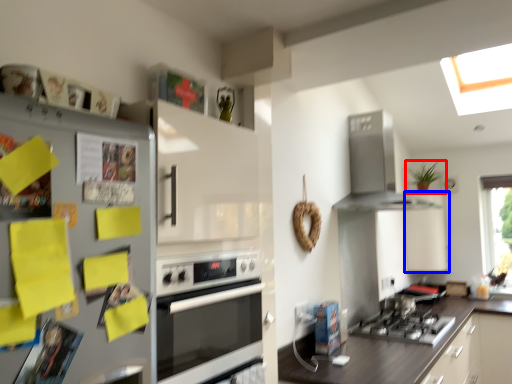
Question: Among these objects, which one is nearest to the camera, houseplant (highlighted by a red box) or cabinetry (highlighted by a blue box)?

Choices:
 (A) houseplant
 (B) cabinetry

Answer: (B)